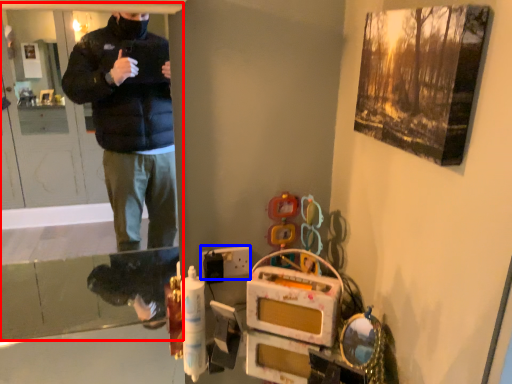
Question: Which of the following is the farthest to the observer, screen door (highlighted by a red box) or switch (highlighted by a blue box)?

Choices:
 (A) screen door
 (B) switch

Answer: (B)